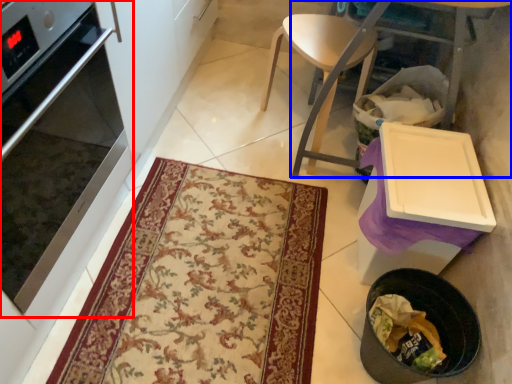
Question: Which of the following is the farthest to the observer, oven (highlighted by a red box) or table (highlighted by a blue box)?

Choices:
 (A) oven
 (B) table

Answer: (B)